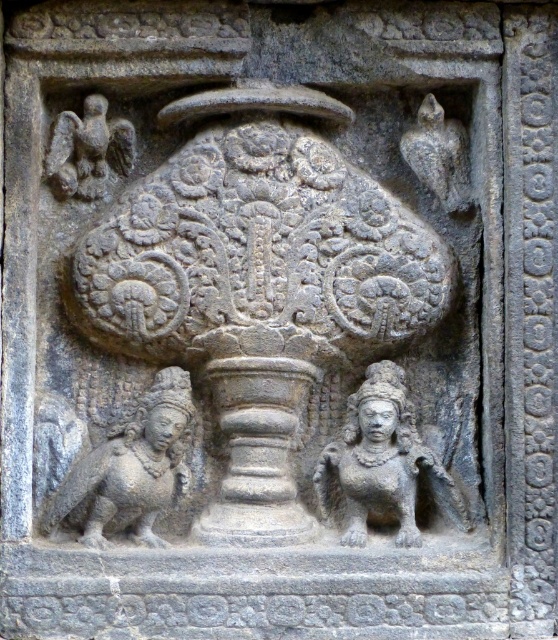
Can you confirm if gray stone deity at lower right is positioned below dark gray stone eagle at upper left?

Yes.

Can you confirm if gray stone deity at lower right is shorter than dark gray stone eagle at upper left?

No.

Locate an element on the screen. The image size is (558, 640). gray stone deity at lower right is located at coordinates (382, 464).

Where is `gray stone deity at lower right`? gray stone deity at lower right is located at coordinates (382, 464).

Does gray stone vase at center appear on the right side of dark gray stone eagle at upper left?

Indeed, gray stone vase at center is positioned on the right side of dark gray stone eagle at upper left.

Does point (247, 433) lie behind point (74, 132)?

No, (247, 433) is in front of (74, 132).

Does point (194, 301) come behind point (83, 148)?

No, (194, 301) is in front of (83, 148).

The width and height of the screenshot is (558, 640). In order to click on gray stone vase at center in this screenshot , I will do `click(258, 292)`.

Looking at this image, is gray stone bird at left positioned before gray stone eagle at upper right?

That is True.

Is point (174, 467) less distant than point (448, 156)?

Yes, point (174, 467) is closer to viewer.

Who is more distant from viewer, (166, 406) or (449, 192)?

Point (449, 192)

What are the coordinates of `gray stone bird at left` in the screenshot? It's located at (131, 468).